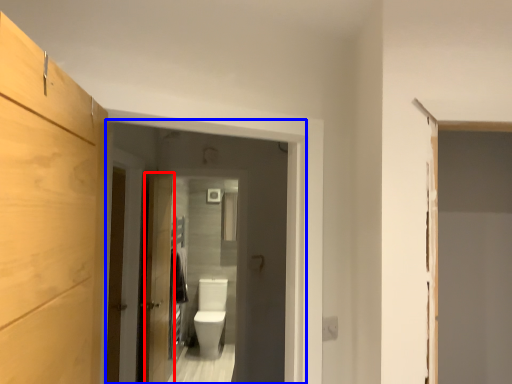
Question: Which object is further to the camera taking this photo, door (highlighted by a red box) or screen door (highlighted by a blue box)?

Choices:
 (A) door
 (B) screen door

Answer: (A)